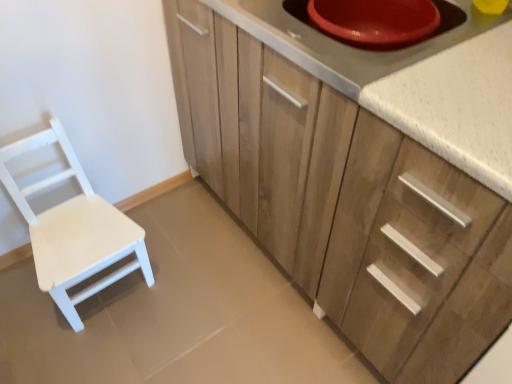
Question: Does white matte wood chair at left appear on the right side of white speckled countertop at upper right?

Choices:
 (A) no
 (B) yes

Answer: (A)

Question: Does white matte wood chair at left have a greater height compared to white speckled countertop at upper right?

Choices:
 (A) no
 (B) yes

Answer: (B)

Question: Is white speckled countertop at upper right a part of white matte wood chair at left?

Choices:
 (A) no
 (B) yes

Answer: (A)

Question: Considering the relative sizes of white matte wood chair at left and white speckled countertop at upper right in the image provided, is white matte wood chair at left thinner than white speckled countertop at upper right?

Choices:
 (A) no
 (B) yes

Answer: (B)

Question: From the image's perspective, is white matte wood chair at left above white speckled countertop at upper right?

Choices:
 (A) no
 (B) yes

Answer: (A)

Question: Are white matte wood chair at left and white speckled countertop at upper right making contact?

Choices:
 (A) yes
 (B) no

Answer: (B)

Question: Can you confirm if wooden cabinet at center is shorter than white speckled countertop at upper right?

Choices:
 (A) yes
 (B) no

Answer: (B)

Question: From the image's perspective, is wooden cabinet at center on top of white speckled countertop at upper right?

Choices:
 (A) yes
 (B) no

Answer: (B)

Question: Is wooden cabinet at center oriented towards white speckled countertop at upper right?

Choices:
 (A) no
 (B) yes

Answer: (A)

Question: Would you say white speckled countertop at upper right is part of wooden cabinet at center's contents?

Choices:
 (A) no
 (B) yes

Answer: (B)

Question: Is wooden cabinet at center positioned in front of white speckled countertop at upper right?

Choices:
 (A) no
 (B) yes

Answer: (B)

Question: Are wooden cabinet at center and white speckled countertop at upper right beside each other?

Choices:
 (A) yes
 (B) no

Answer: (B)

Question: Is white speckled countertop at upper right closer to camera compared to white matte wood chair at left?

Choices:
 (A) yes
 (B) no

Answer: (A)